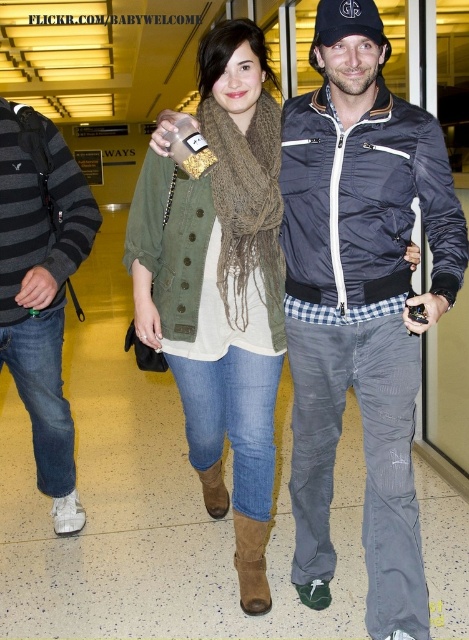
In the airport terminal scene, you notice two items of clothing worn by different people. The first is the matte blue bomber jacket at center, and the second is the black cap at upper center. Which of these two items is taller?

The matte blue bomber jacket at center is taller than the black cap at upper center.